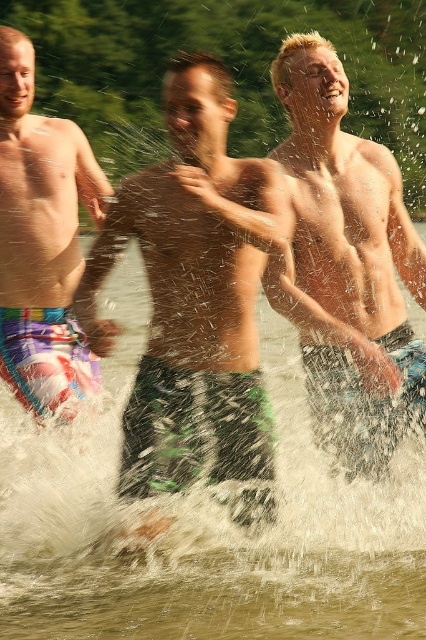
Looking at the scene, where is the green textured shorts at center in relation to the multicolored swim trunks at left?

The green textured shorts at center is to the right of the multicolored swim trunks at left.

You are a photographer trying to capture a candid shot of the two individuals in the scene. You notice the green textured shorts at center and the multicolored swim trunks at left. Which of these two items is positioned lower in the frame?

The green textured shorts at center has a lesser height compared to the multicolored swim trunks at left, so it is positioned lower in the frame.